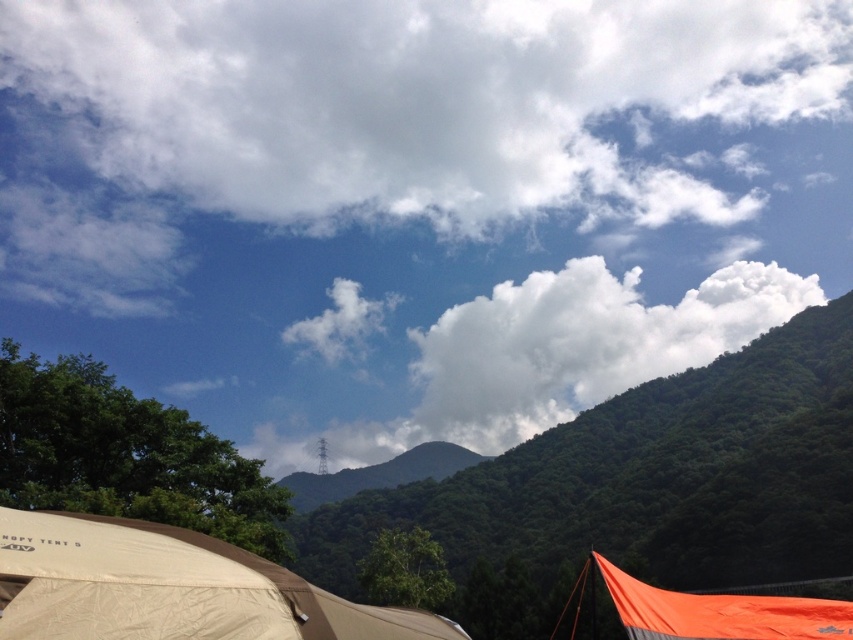
Question: Does white fluffy cloud at center come in front of beige fabric tent at lower left?

Choices:
 (A) yes
 (B) no

Answer: (B)

Question: Is beige fabric tent at lower left closer to camera compared to orange fabric tent at lower right?

Choices:
 (A) yes
 (B) no

Answer: (A)

Question: Which of the following is the closest to the observer?

Choices:
 (A) white fluffy cloud at center
 (B) white fluffy cloud at upper center
 (C) beige fabric tent at lower left
 (D) green leafy hillside at upper center

Answer: (C)

Question: Which of these objects is positioned closest to the green leafy hillside at upper center?

Choices:
 (A) white fluffy cloud at upper center
 (B) orange fabric tent at lower right
 (C) white fluffy cloud at center

Answer: (C)

Question: Which of these objects is positioned farthest from the beige fabric tent at lower left?

Choices:
 (A) white fluffy cloud at center
 (B) orange fabric tent at lower right
 (C) white fluffy cloud at upper center

Answer: (C)

Question: Does white fluffy cloud at upper center have a lesser width compared to orange fabric tent at lower right?

Choices:
 (A) yes
 (B) no

Answer: (B)